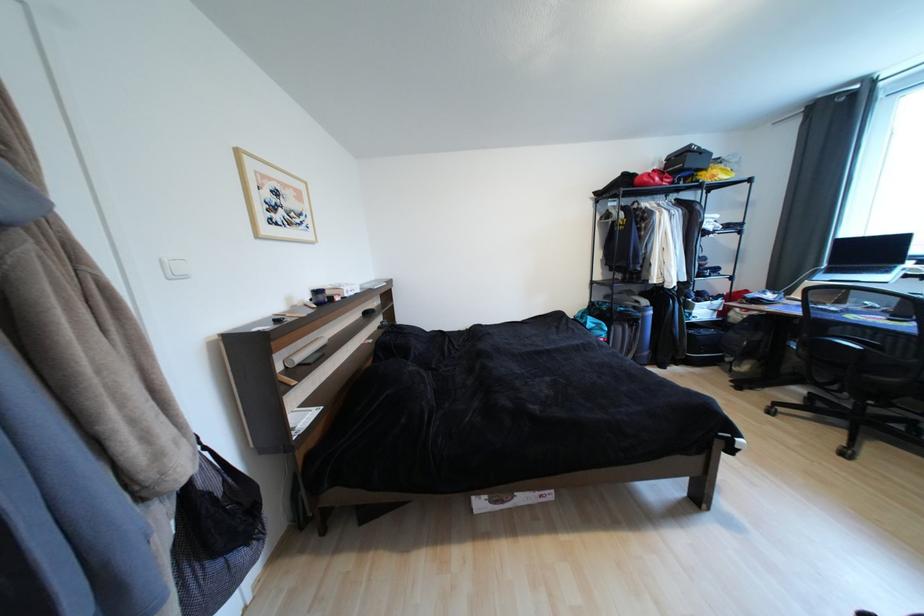
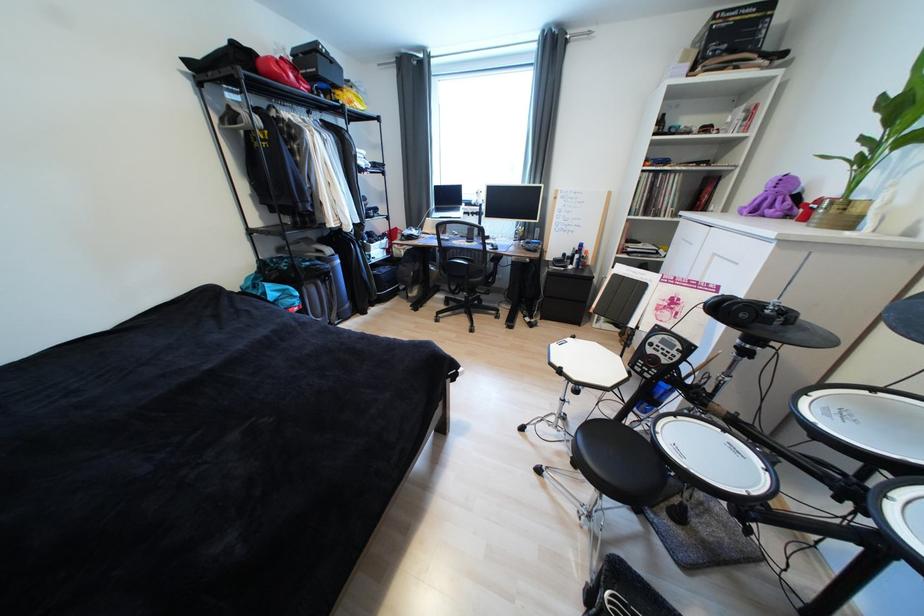
The first image is from the beginning of the video and the second image is from the end. How did the camera likely rotate when shooting the video?

The camera rotated toward right-down.